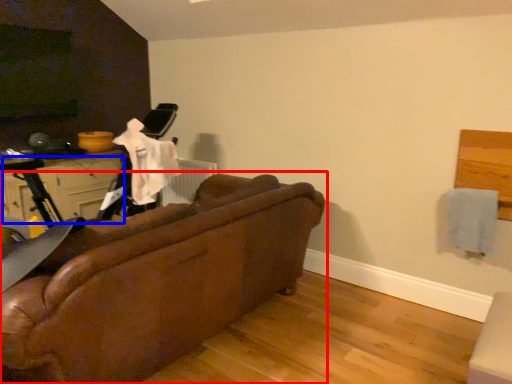
Question: Which of the following is the closest to the observer, studio couch (highlighted by a red box) or drawer (highlighted by a blue box)?

Choices:
 (A) studio couch
 (B) drawer

Answer: (A)